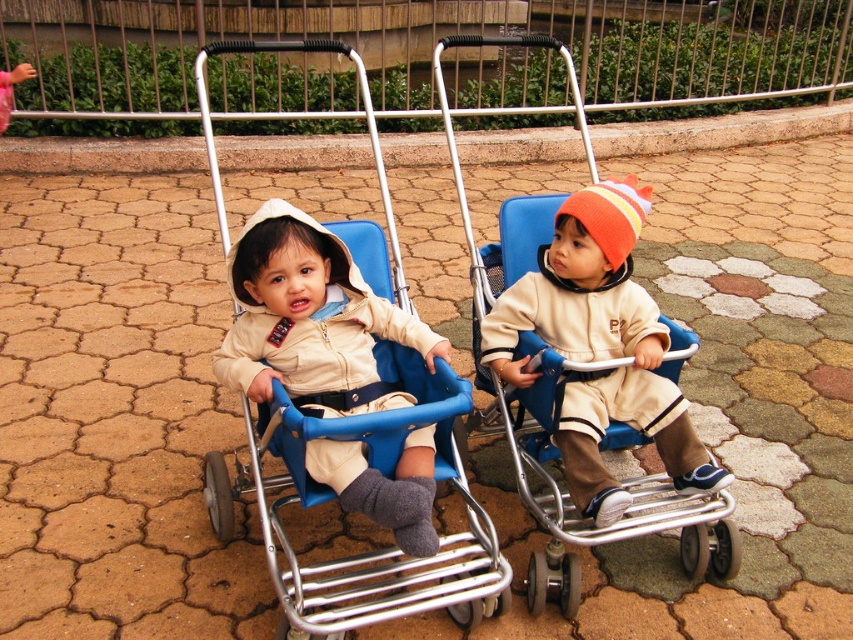
Question: Is metallic blue baby carriage at center further to camera compared to matte beige sweater at center?

Choices:
 (A) no
 (B) yes

Answer: (A)

Question: Among these points, which one is farthest from the camera?

Choices:
 (A) (651, 374)
 (B) (380, 381)

Answer: (A)

Question: Can you confirm if metallic blue baby carriage at center is smaller than beige soft fabric jacket at center?

Choices:
 (A) no
 (B) yes

Answer: (A)

Question: Which object is farther from the camera taking this photo?

Choices:
 (A) metallic blue baby carriage at center
 (B) matte beige sweater at center
 (C) beige soft fabric jacket at center

Answer: (B)

Question: Which point is farther from the camera taking this photo?

Choices:
 (A) (666, 456)
 (B) (378, 339)

Answer: (B)

Question: Considering the relative positions of beige soft fabric jacket at center and matte beige sweater at center in the image provided, where is beige soft fabric jacket at center located with respect to matte beige sweater at center?

Choices:
 (A) below
 (B) above

Answer: (A)